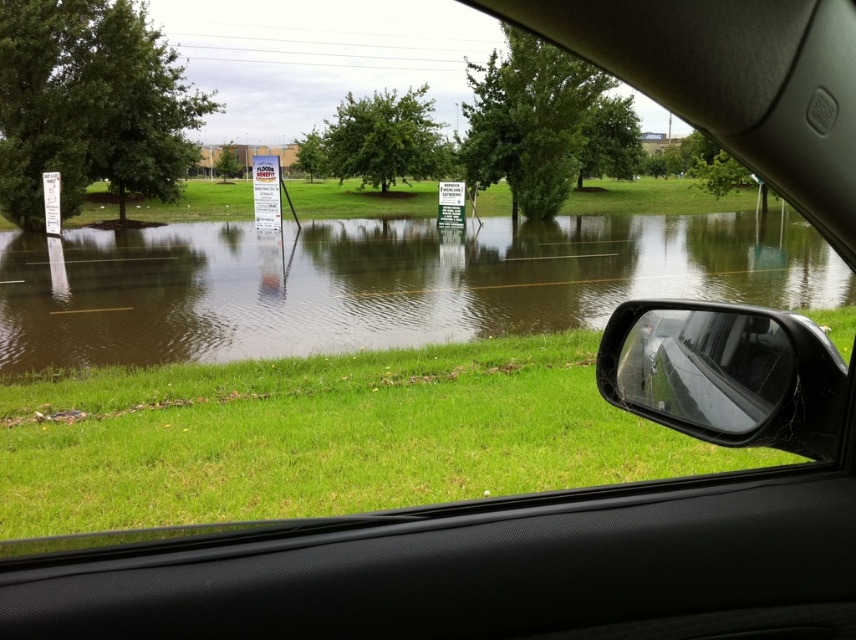
You are a driver inside the vehicle looking out. You notice the brown murky water at lower left and the transparent glass side mirror at lower right. Which object is higher in the scene?

The brown murky water at lower left is much taller than the transparent glass side mirror at lower right, so the brown murky water at lower left is higher in the scene.

Looking at this image, you are a driver inside the vehicle looking out. You notice the brown murky water at lower left and the transparent glass side mirror at lower right. Which object is closer to you?

The brown murky water at lower left is closer to you because it is further to the viewer than the transparent glass side mirror at lower right.

Looking at this image, you are inside the vehicle looking out the windshield at the flooded area. There are two points marked on the windshield, one at coordinates point (854, 291) and the other at point (681, 394). Which point is closer to you, the observer?

Point (681, 394) is closer to you because it is in front of point 0.456, 0.996.